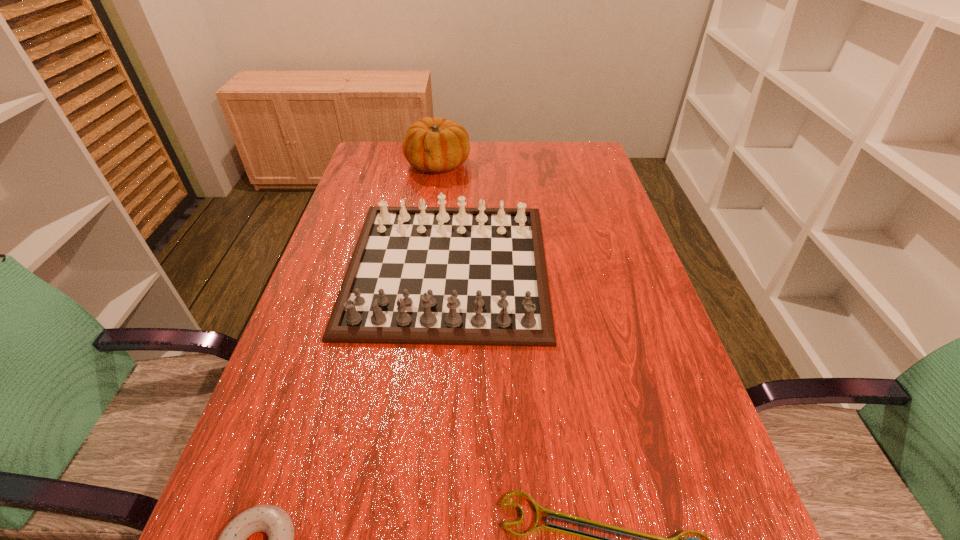
The image size is (960, 540). I want to click on blank space at the far edge, so point(484,170).

At what (x,y) coordinates should I click in order to perform the action: click on free space at the left edge of the desktop. Please return your answer as a coordinate pair (x, y). Looking at the image, I should click on tap(236, 474).

Find the location of `vacant space at the right edge`. vacant space at the right edge is located at coordinates (641, 487).

Find the location of a particular element. vacant space at the far left corner is located at coordinates (407, 168).

At what (x,y) coordinates should I click in order to perform the action: click on free region at the far right corner of the desktop. Please return your answer as a coordinate pair (x, y). The height and width of the screenshot is (540, 960). Looking at the image, I should click on (570, 163).

Identify which object is located as the nearest to the second shortest object. Please provide its 2D coordinates. Your answer should be formatted as a tuple, i.e. [(x, y)], where the tuple contains the x and y coordinates of a point satisfying the conditions above.

[(637, 539)]

Identify the location of the closest object relative to the doughnut. (637, 539).